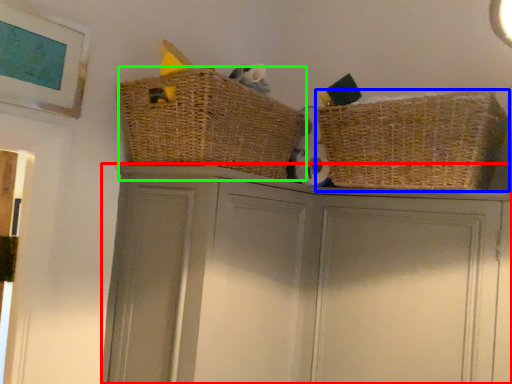
Question: Based on their relative distances, which object is nearer to cupboard (highlighted by a red box)? Choose from basket (highlighted by a blue box) and basket (highlighted by a green box).

Choices:
 (A) basket
 (B) basket

Answer: (B)